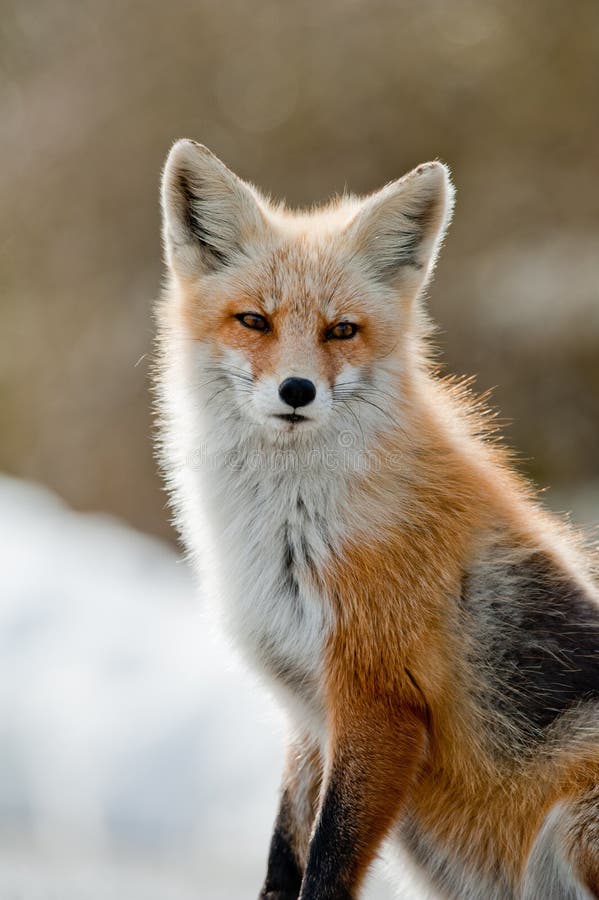
At what (x,y) coordinates should I click in order to perform the action: click on white fur. Please return your answer as a coordinate pair (x, y). Looking at the image, I should click on (235, 569).